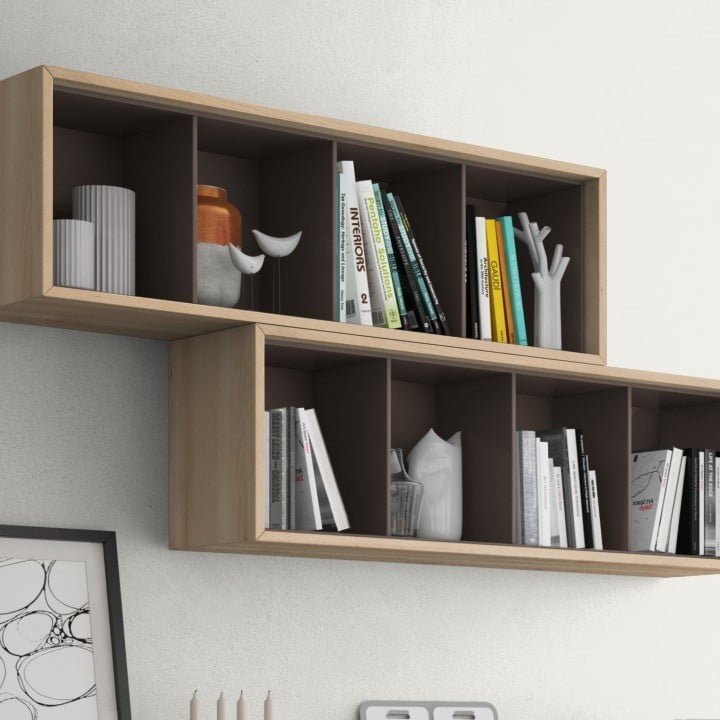
You are a GUI agent. You are given a task and a screenshot of the screen. Output one action in this format:
    pyautogui.click(x=<x>, y=<y>)
    Task: Click on the cubbies
    
    Given the screenshot: What is the action you would take?
    pyautogui.click(x=130, y=126), pyautogui.click(x=235, y=145), pyautogui.click(x=387, y=166), pyautogui.click(x=523, y=186), pyautogui.click(x=338, y=368), pyautogui.click(x=435, y=377), pyautogui.click(x=551, y=392), pyautogui.click(x=652, y=400)